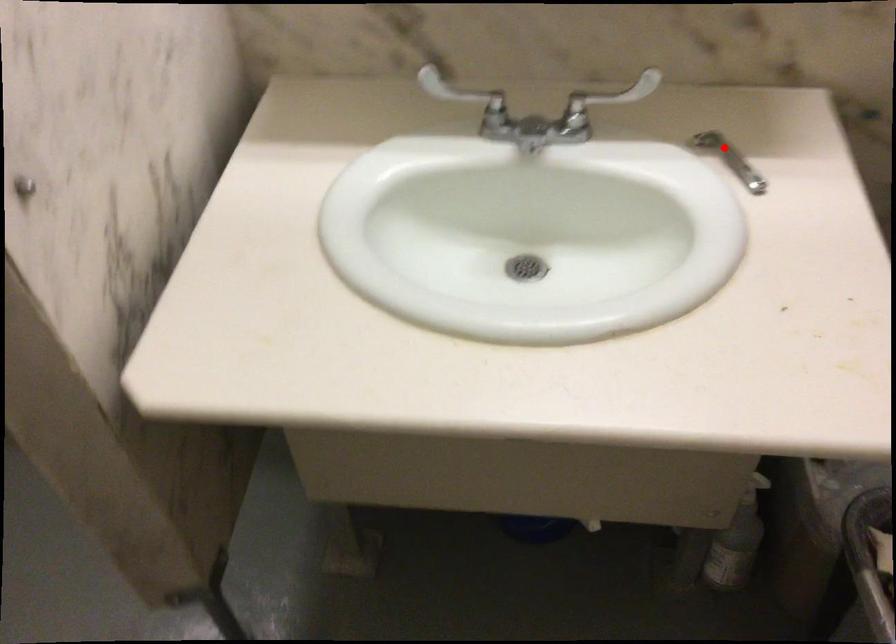
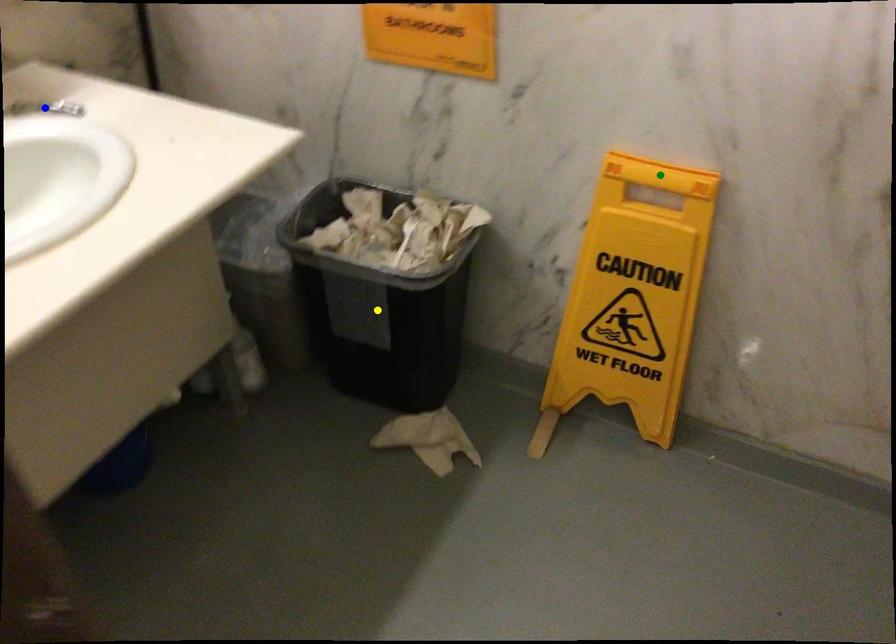
Question: I am providing you with two images of the same scene from different viewpoints. A red point is marked on the first image. You are given multiple points on the second image. Which mark in image 2 goes with the point in image 1?

Choices:
 (A) blue point
 (B) green point
 (C) yellow point

Answer: (A)